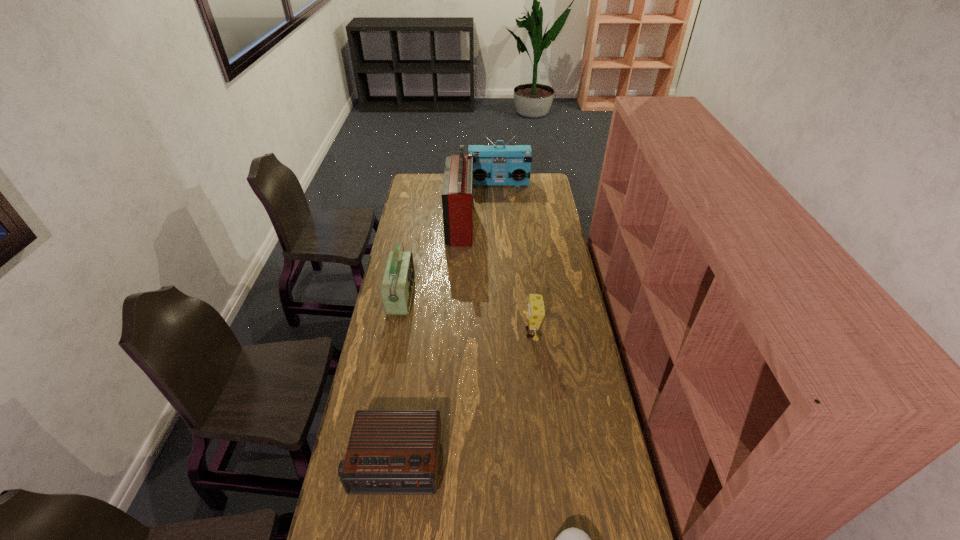
The height and width of the screenshot is (540, 960). In the image, there is a desktop. In order to click on free space at the far left corner in this screenshot , I will do [x=417, y=181].

Identify the location of vacant space in between the shortest radio receiver and the farthest object. The width and height of the screenshot is (960, 540). (446, 323).

I want to click on vacant area that lies between the third nearest radio receiver and the third tallest radio receiver, so click(431, 260).

Where is `free space between the second tallest object and the sponge`? The width and height of the screenshot is (960, 540). free space between the second tallest object and the sponge is located at coordinates (515, 258).

Where is `unoccupied position between the second farthest radio receiver and the sponge`? unoccupied position between the second farthest radio receiver and the sponge is located at coordinates (496, 278).

Locate an element on the screen. The width and height of the screenshot is (960, 540). free point between the nearest radio receiver and the farthest radio receiver is located at coordinates (446, 323).

The image size is (960, 540). Identify the location of the closest object to the sponge. (390, 451).

You are a GUI agent. You are given a task and a screenshot of the screen. Output one action in this format:
    pyautogui.click(x=<x>, y=<y>)
    Task: Click on the object identified as the fourth closest to the third tallest object
    The width and height of the screenshot is (960, 540).
    Given the screenshot: What is the action you would take?
    pyautogui.click(x=492, y=165)

Select which radio receiver is the fourth closest to the baseball cap. Please provide its 2D coordinates. Your answer should be formatted as a tuple, i.e. [(x, y)], where the tuple contains the x and y coordinates of a point satisfying the conditions above.

[(492, 165)]

Identify which radio receiver is the nearest to the second farthest object. Please provide its 2D coordinates. Your answer should be formatted as a tuple, i.e. [(x, y)], where the tuple contains the x and y coordinates of a point satisfying the conditions above.

[(492, 165)]